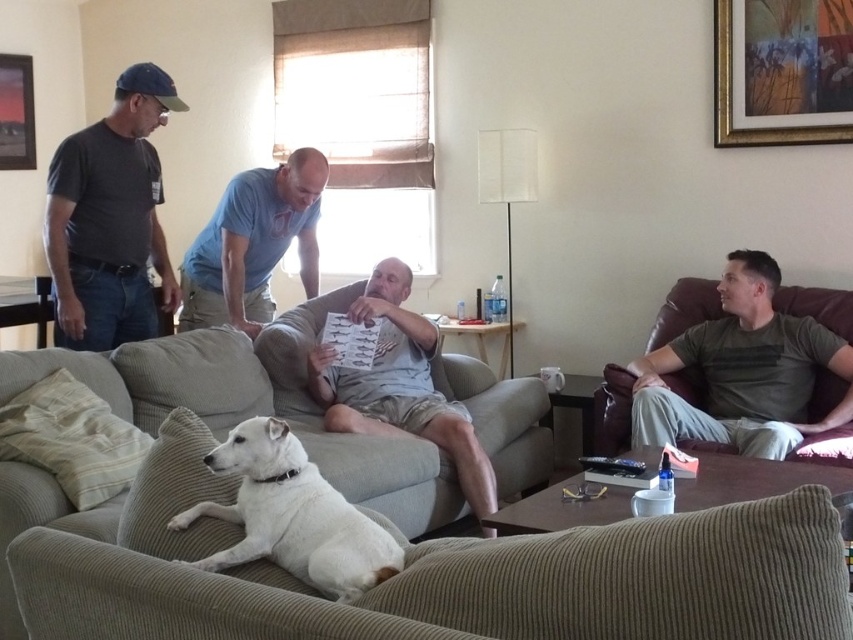
In the scene shown: Is beige corduroy couch at center smaller than dark gray t-shirt at left?

No.

Does beige corduroy couch at center have a lesser height compared to dark gray t-shirt at left?

Correct, beige corduroy couch at center is not as tall as dark gray t-shirt at left.

In order to click on beige corduroy couch at center in this screenshot , I will do tap(248, 416).

Can you confirm if dark gray t-shirt at left is shorter than green cotton shirt at right?

No, dark gray t-shirt at left is not shorter than green cotton shirt at right.

Image resolution: width=853 pixels, height=640 pixels. I want to click on dark gray t-shirt at left, so click(x=109, y=218).

Identify the location of dark gray t-shirt at left. (109, 218).

Who is more distant from viewer, (4,552) or (756,262)?

Point (756,262)

Locate an element on the screen. The width and height of the screenshot is (853, 640). beige corduroy couch at center is located at coordinates (x=248, y=416).

What are the coordinates of `beige corduroy couch at center` in the screenshot? It's located at point(248,416).